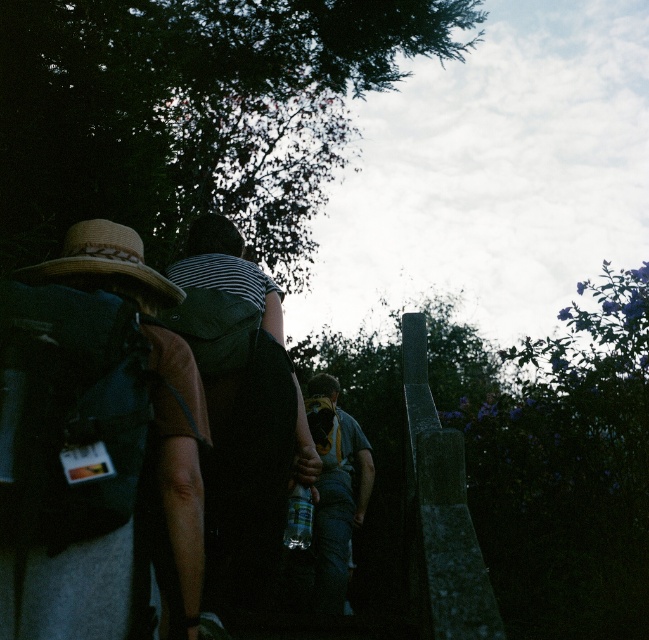
Is matte straw hat at left to the left of striped fabric shirt at center from the viewer's perspective?

Correct, you'll find matte straw hat at left to the left of striped fabric shirt at center.

Between matte straw hat at left and striped fabric shirt at center, which one has less height?

Standing shorter between the two is matte straw hat at left.

The height and width of the screenshot is (640, 649). In order to click on matte straw hat at left in this screenshot , I will do `click(92, 440)`.

Is matte straw hat at left to the right of straw hat at upper left from the viewer's perspective?

Correct, you'll find matte straw hat at left to the right of straw hat at upper left.

Describe the element at coordinates (92, 440) in the screenshot. The width and height of the screenshot is (649, 640). I see `matte straw hat at left` at that location.

Which is behind, point (14, 564) or point (178, 300)?

Positioned behind is point (178, 300).

What are the coordinates of `matte straw hat at left` in the screenshot? It's located at (92, 440).

Is point (254, 598) closer to camera compared to point (337, 452)?

Yes, it is.

Looking at this image, who is positioned more to the left, striped fabric shirt at center or denim jeans at center?

Positioned to the left is striped fabric shirt at center.

Find the location of a particular element. Image resolution: width=649 pixels, height=640 pixels. striped fabric shirt at center is located at coordinates (245, 422).